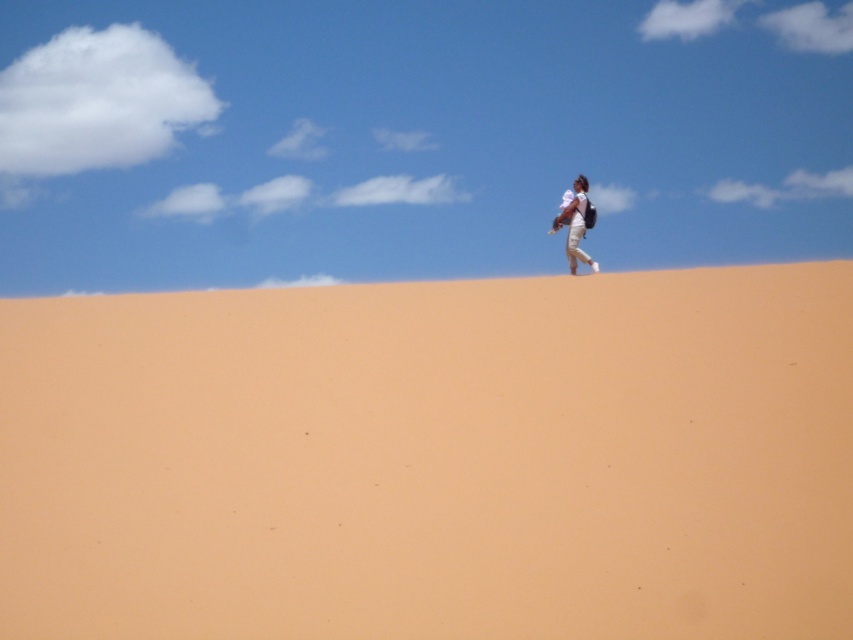
You are standing in the desert and see the smooth tan sand at upper center and the white cotton shirt at upper center. Which object is positioned to the left of the other?

The smooth tan sand at upper center is to the left of the white cotton shirt at upper center.

You are a photographer planning to capture the desert landscape. You want to ensure the white cotton shirt at upper center is clearly visible against the smooth tan sand at upper center. Based on the scene description, will the contrast between the two objects be sufficient for clear visibility?

The smooth tan sand at upper center has a larger size compared to white cotton shirt at upper center. Since the sand is larger in size, the contrast in color and texture between the white cotton shirt and the tan sand should be sufficient for clear visibility in the photograph.